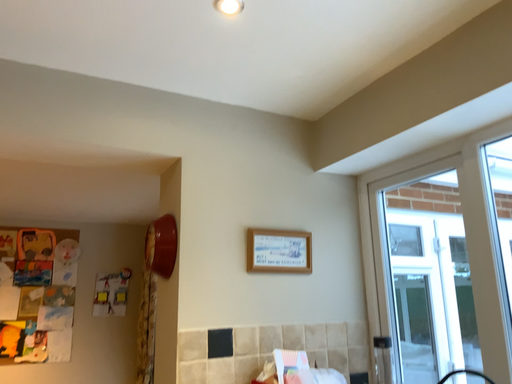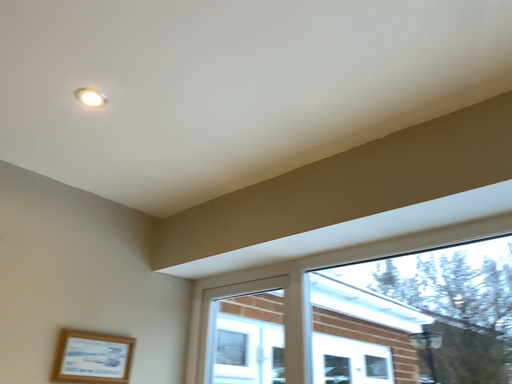
Question: How did the camera likely rotate when shooting the video?

Choices:
 (A) rotated upward
 (B) rotated downward

Answer: (A)